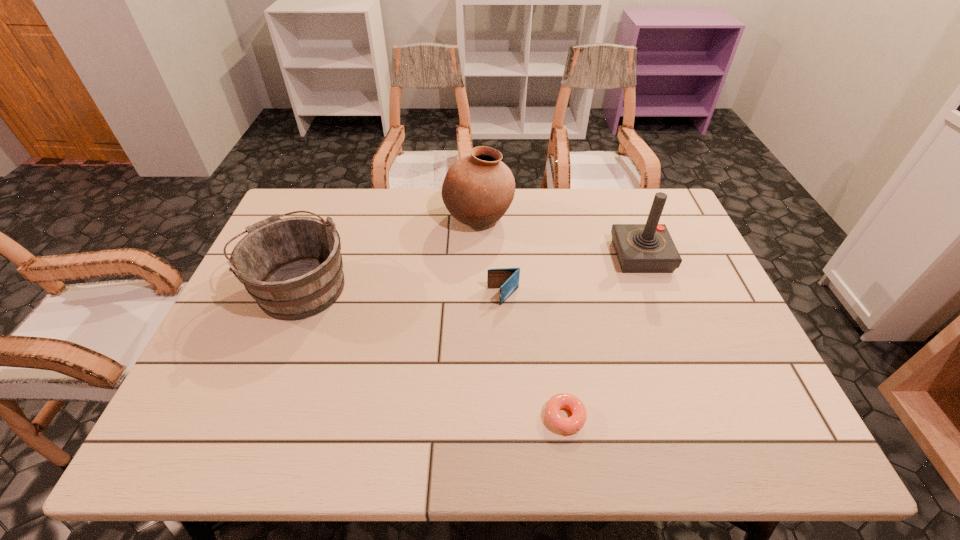
In order to click on free spot between the fourth tallest object and the rightmost object in this screenshot , I will do `click(572, 276)`.

This screenshot has height=540, width=960. I want to click on free spot between the pottery and the rightmost object, so click(x=560, y=238).

This screenshot has height=540, width=960. I want to click on free space between the rightmost object and the pottery, so click(x=560, y=238).

Identify the location of free space between the pottery and the fourth tallest object. The height and width of the screenshot is (540, 960). (491, 258).

In order to click on empty space between the wallet and the joystick in this screenshot , I will do 572,276.

Find the location of a particular element. Image resolution: width=960 pixels, height=540 pixels. free area in between the joystick and the wallet is located at coordinates (572, 276).

Identify the location of free spot between the joystick and the pottery. The height and width of the screenshot is (540, 960). (560, 238).

Identify which object is the nearest to the nearest object. Please provide its 2D coordinates. Your answer should be formatted as a tuple, i.e. [(x, y)], where the tuple contains the x and y coordinates of a point satisfying the conditions above.

[(507, 279)]

In order to click on the fourth closest object to the rightmost object in this screenshot , I will do `click(293, 268)`.

This screenshot has width=960, height=540. In order to click on free space that satisfies the following two spatial constraints: 1. on the back side of the pottery; 2. on the right side of the leftmost object in this screenshot , I will do `click(325, 219)`.